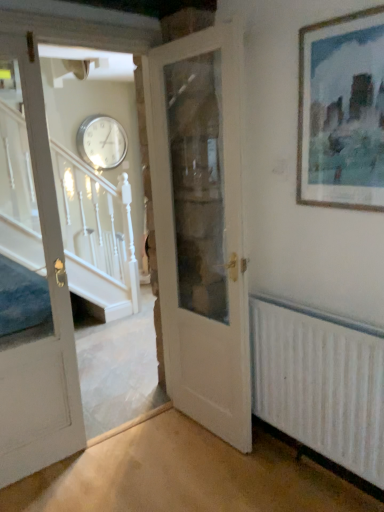
The width and height of the screenshot is (384, 512). I want to click on vacant space that is to the left of white wooden door at center, placed as the 1th door when sorted from right to left, so click(x=150, y=447).